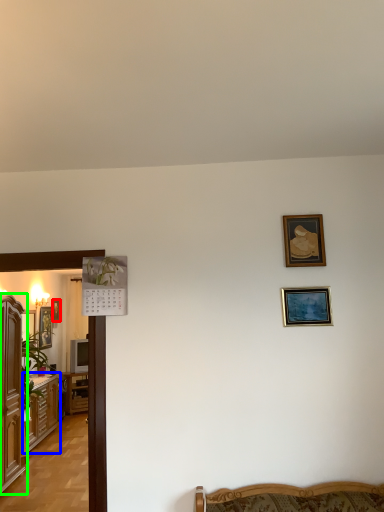
Question: Estimate the real-world distances between objects in this image. Which object is closer to picture frame (highlighted by a red box), cabinetry (highlighted by a blue box) or cabinetry (highlighted by a green box)?

Choices:
 (A) cabinetry
 (B) cabinetry

Answer: (A)